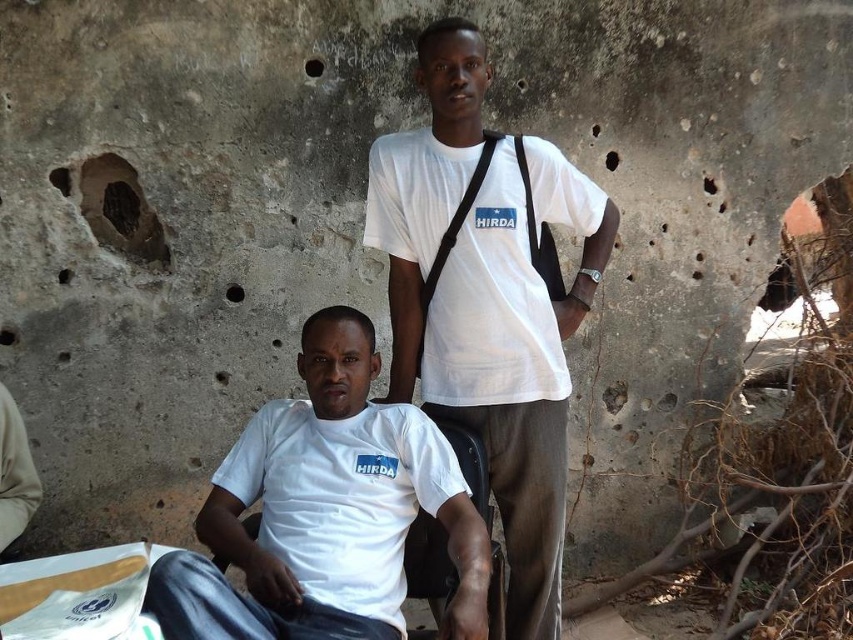
Who is lower down, white cotton shirt at center or white cotton t-shirt at upper center?

Positioned lower is white cotton shirt at center.

Can you confirm if white cotton shirt at center is bigger than white cotton t-shirt at upper center?

Indeed, white cotton shirt at center has a larger size compared to white cotton t-shirt at upper center.

What do you see at coordinates (325, 512) in the screenshot? I see `white cotton shirt at center` at bounding box center [325, 512].

I want to click on white cotton shirt at center, so click(325, 512).

Is white matte t-shirt at center to the right of white cotton shirt at center from the viewer's perspective?

Indeed, white matte t-shirt at center is positioned on the right side of white cotton shirt at center.

Can you confirm if white matte t-shirt at center is positioned to the left of white cotton shirt at center?

In fact, white matte t-shirt at center is to the right of white cotton shirt at center.

Image resolution: width=853 pixels, height=640 pixels. I want to click on white matte t-shirt at center, so 486,301.

Between point (479, 33) and point (485, 216), which one is positioned behind?

Positioned behind is point (485, 216).

From the picture: Can you confirm if white matte t-shirt at center is wider than white cotton t-shirt at upper center?

Yes, white matte t-shirt at center is wider than white cotton t-shirt at upper center.

Image resolution: width=853 pixels, height=640 pixels. What do you see at coordinates (486, 301) in the screenshot? I see `white matte t-shirt at center` at bounding box center [486, 301].

Locate an element on the screen. The height and width of the screenshot is (640, 853). white matte t-shirt at center is located at coordinates (486, 301).